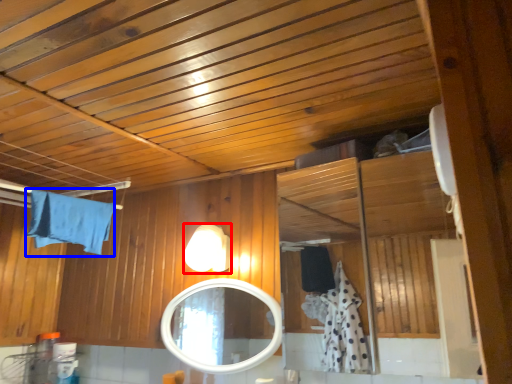
Question: Which of the following is the farthest to the observer, light fixture (highlighted by a red box) or bath towel (highlighted by a blue box)?

Choices:
 (A) light fixture
 (B) bath towel

Answer: (A)